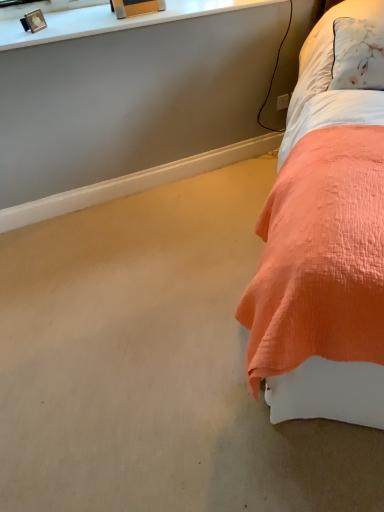
Question: From the image's perspective, relative to coral quilted bed at right, is metallic gold picture frame at upper left above or below?

Choices:
 (A) below
 (B) above

Answer: (B)

Question: Is metallic gold picture frame at upper left to the left or to the right of coral quilted bed at right in the image?

Choices:
 (A) left
 (B) right

Answer: (A)

Question: Based on their relative distances, which object is farther from the white plastic power outlet at upper right?

Choices:
 (A) coral quilted bed at right
 (B) metallic gold picture frame at upper left

Answer: (B)

Question: Estimate the real-world distances between objects in this image. Which object is closer to the white plastic power outlet at upper right?

Choices:
 (A) coral quilted bed at right
 (B) metallic gold picture frame at upper left

Answer: (A)